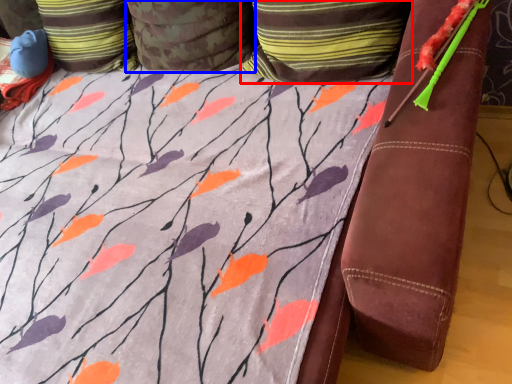
Question: Which of the following is the closest to the observer, pillow (highlighted by a red box) or pillow (highlighted by a blue box)?

Choices:
 (A) pillow
 (B) pillow

Answer: (A)